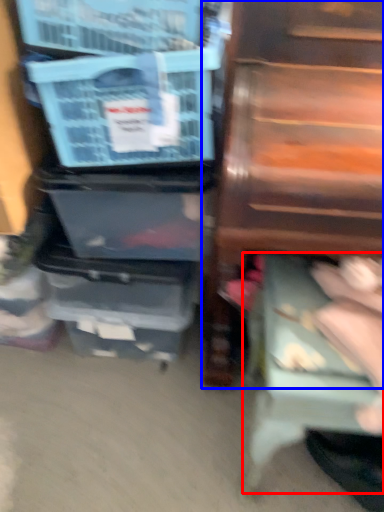
Question: Among these objects, which one is farthest to the camera, step stool (highlighted by a red box) or furniture (highlighted by a blue box)?

Choices:
 (A) step stool
 (B) furniture

Answer: (A)